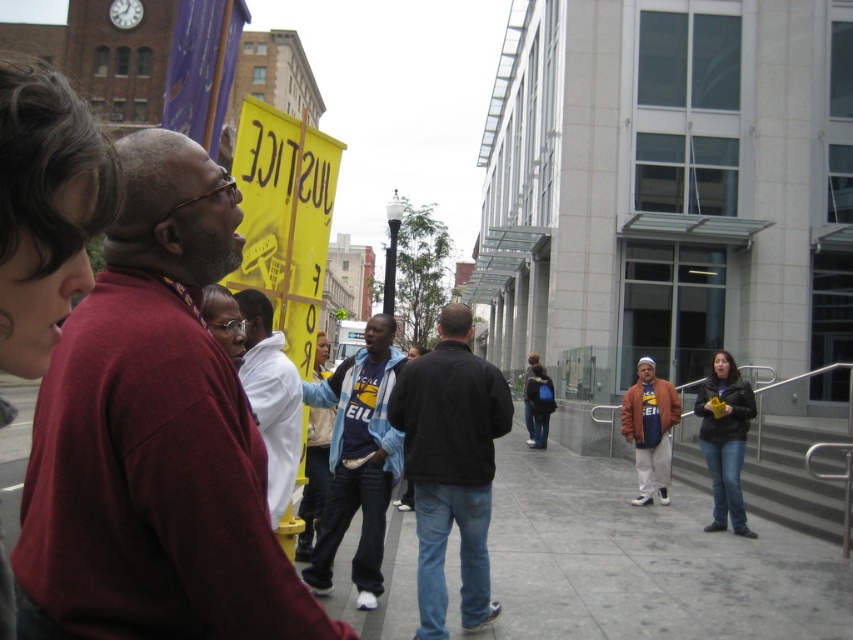
Does maroon sweater at left have a smaller size compared to smooth concrete sidewalk at center?

Yes, maroon sweater at left is smaller than smooth concrete sidewalk at center.

Is point (187, 416) positioned in front of point (676, 593)?

Yes, point (187, 416) is closer to viewer.

The image size is (853, 640). I want to click on maroon sweater at left, so click(154, 436).

Is maroon sweater at left further to camera compared to blue denim jeans at center?

No, it is not.

Locate an element on the screen. This screenshot has height=640, width=853. maroon sweater at left is located at coordinates (154, 436).

The width and height of the screenshot is (853, 640). Describe the element at coordinates (154, 436) in the screenshot. I see `maroon sweater at left` at that location.

What are the coordinates of `maroon sweater at left` in the screenshot? It's located at (154, 436).

Who is lower down, white fleece jacket at center or orange cotton jacket at center?

orange cotton jacket at center is below.

Does white fleece jacket at center have a smaller size compared to orange cotton jacket at center?

Yes.

Where is `white fleece jacket at center`? The image size is (853, 640). white fleece jacket at center is located at coordinates (271, 397).